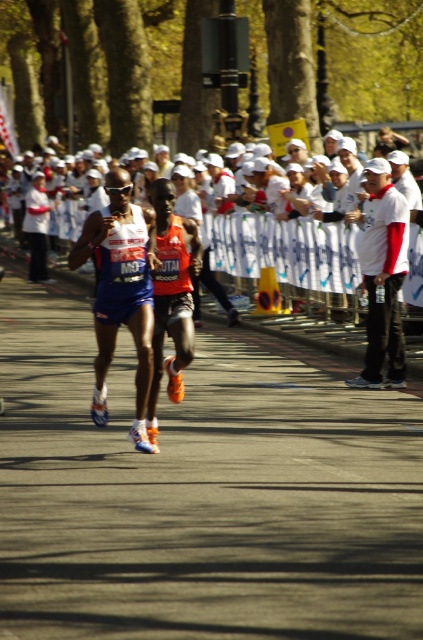
Question: Is blue fabric running suit at center below white matte shirt at upper right?

Choices:
 (A) yes
 (B) no

Answer: (A)

Question: From the image, what is the correct spatial relationship of blue fabric running suit at center in relation to white matte shirt at upper right?

Choices:
 (A) left
 (B) right

Answer: (A)

Question: Which point is farther to the camera?

Choices:
 (A) blue fabric running suit at center
 (B) white matte shirt at upper right

Answer: (B)

Question: Can you confirm if blue fabric running suit at center is positioned below white matte shirt at upper right?

Choices:
 (A) yes
 (B) no

Answer: (A)